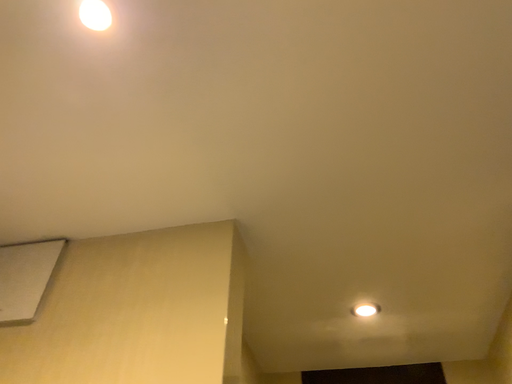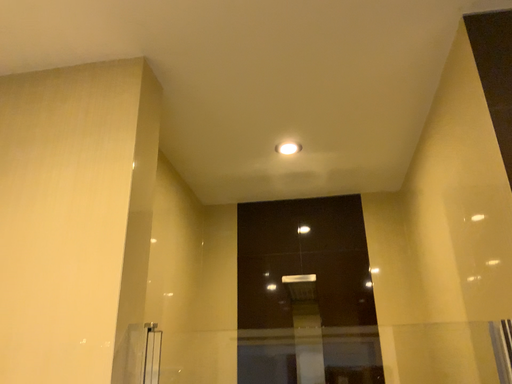
Question: Which way did the camera rotate in the video?

Choices:
 (A) rotated upward
 (B) rotated downward

Answer: (B)